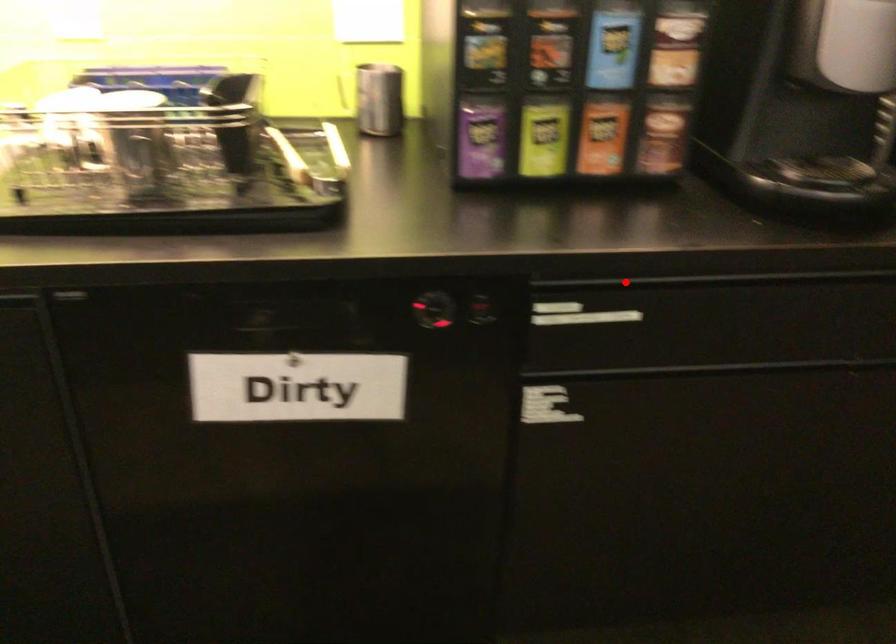
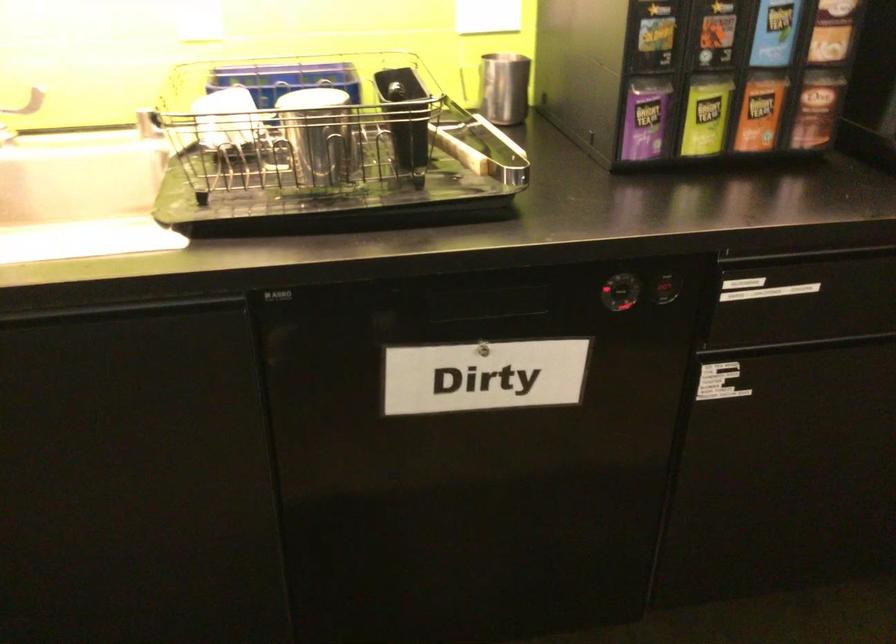
Where in the second image is the point corresponding to the highlighted location from the first image?

(807, 254)